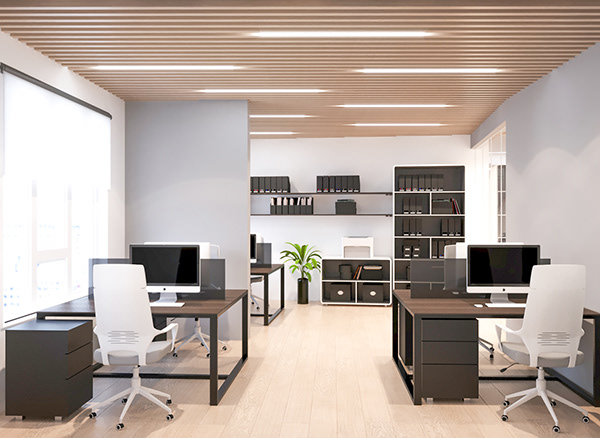
Identify the location of desk. (418, 309), (263, 271), (208, 307).